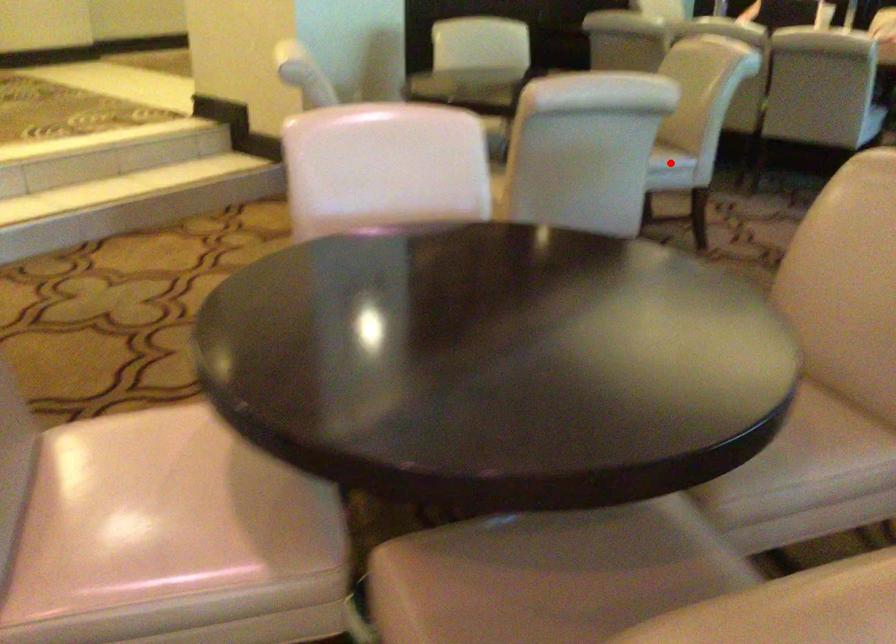
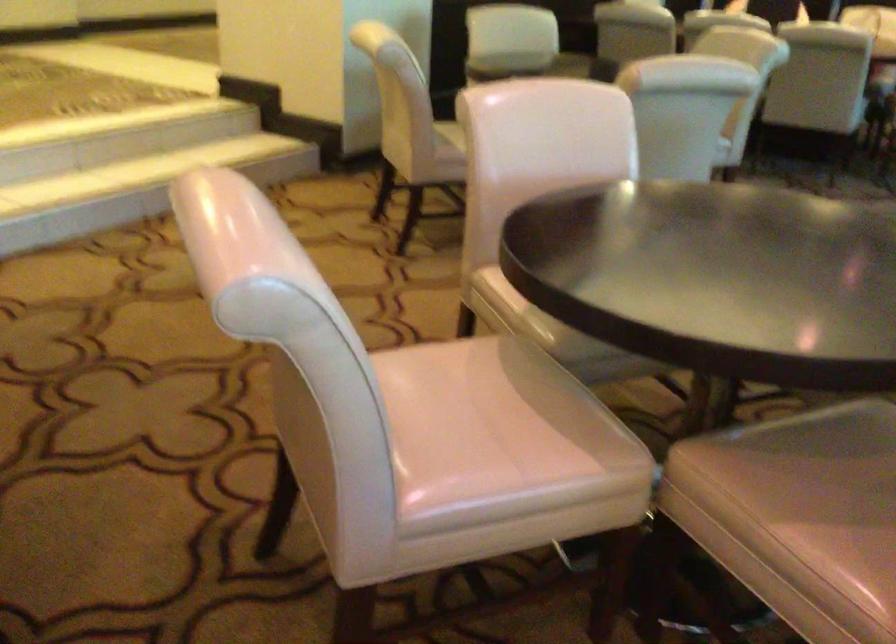
Question: I am providing you with two images of the same scene from different viewpoints. A red point is marked on the first image. At the location where the point appears in image 1, is it still visible in image 2?

Choices:
 (A) Yes
 (B) No

Answer: (B)